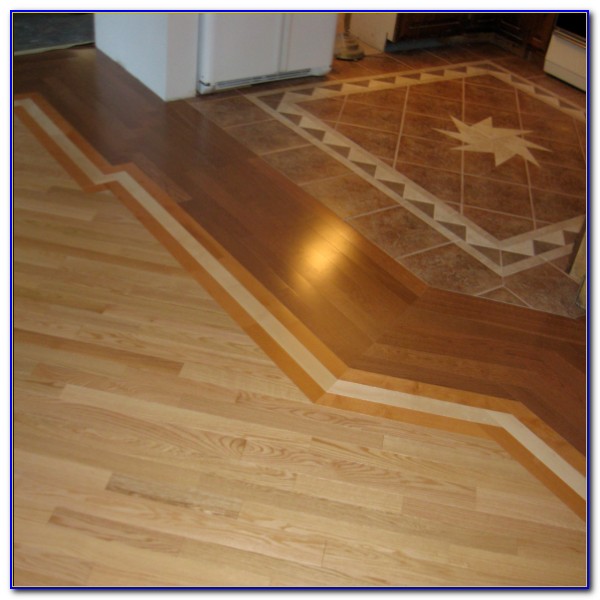
Find the location of a particular element. The image size is (600, 600). medium tone hardwood flooring is located at coordinates 263,227.